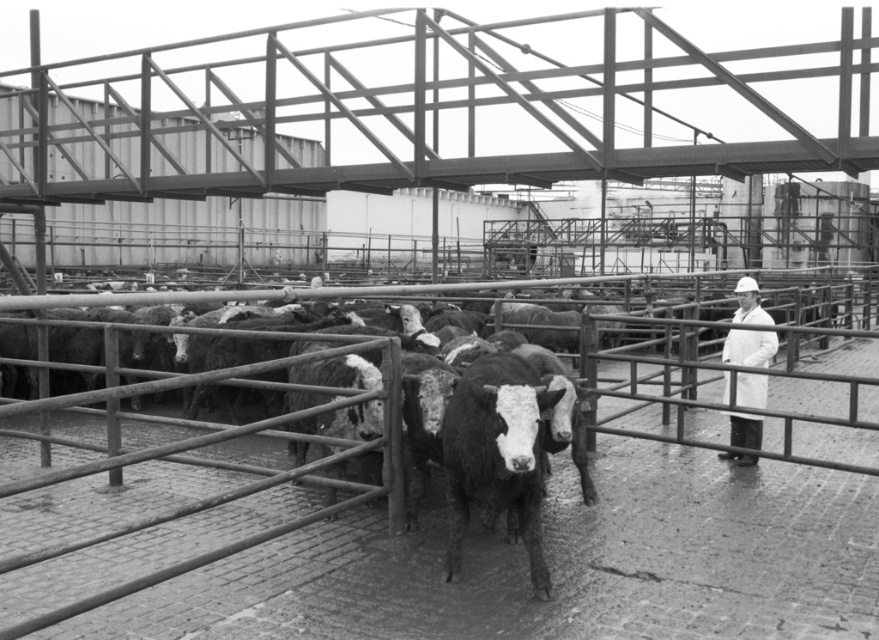
Does black and white textured bull at center have a smaller size compared to white lab coat at center?

Yes, black and white textured bull at center is smaller than white lab coat at center.

Can you confirm if black and white textured bull at center is wider than white lab coat at center?

Incorrect, black and white textured bull at center's width does not surpass white lab coat at center's.

Is point (456, 554) positioned behind point (752, 429)?

No, (456, 554) is in front of (752, 429).

Where is `black and white textured bull at center`? black and white textured bull at center is located at coordinates (496, 454).